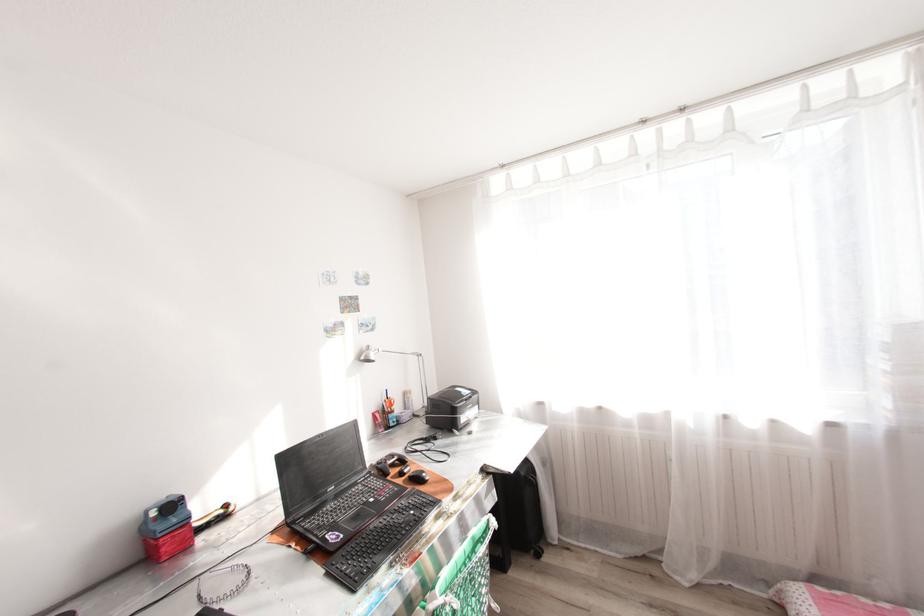
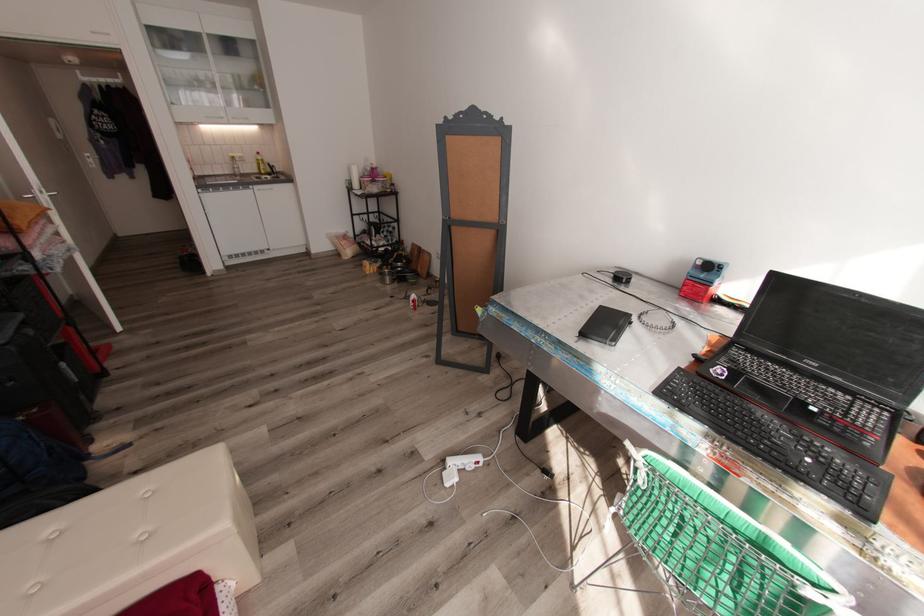
How did the camera likely rotate?

The rotation direction of the camera is left-down.